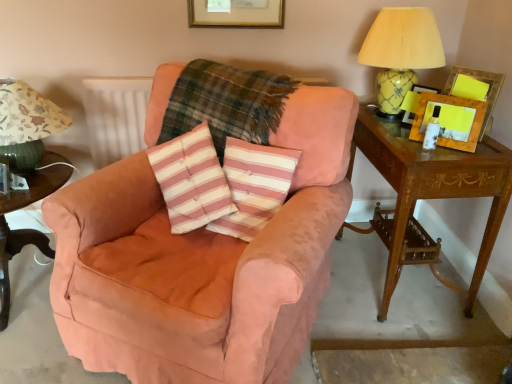
Where is `vacant space situated on the left part of wooden picture frame at right, which is counted as the second picture frame, starting from the right`? Image resolution: width=512 pixels, height=384 pixels. vacant space situated on the left part of wooden picture frame at right, which is counted as the second picture frame, starting from the right is located at coordinates (406, 144).